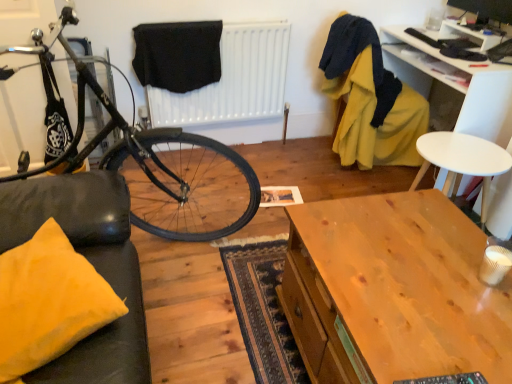
Question: Is yellow fabric pillow at lower left taller than black fabric at center?

Choices:
 (A) yes
 (B) no

Answer: (B)

Question: Is yellow fabric pillow at lower left far from black fabric at center?

Choices:
 (A) yes
 (B) no

Answer: (A)

Question: Is yellow fabric pillow at lower left behind black fabric at center?

Choices:
 (A) no
 (B) yes

Answer: (A)

Question: Does yellow fabric pillow at lower left have a lesser height compared to black fabric at center?

Choices:
 (A) no
 (B) yes

Answer: (B)

Question: Is yellow fabric pillow at lower left next to black fabric at center?

Choices:
 (A) yes
 (B) no

Answer: (B)

Question: Is yellow fabric pillow at lower left located outside black fabric at center?

Choices:
 (A) yes
 (B) no

Answer: (A)

Question: Can you confirm if white plastic chair at upper right, which is the first desk from back to front, is positioned to the left of black fabric at upper center?

Choices:
 (A) no
 (B) yes

Answer: (A)

Question: Does white plastic chair at upper right, which is the 1th desk in top-to-bottom order, have a larger size compared to black fabric at upper center?

Choices:
 (A) yes
 (B) no

Answer: (A)

Question: Does white plastic chair at upper right, placed as the second desk when sorted from left to right, have a lesser width compared to black fabric at upper center?

Choices:
 (A) yes
 (B) no

Answer: (B)

Question: Is the surface of white plastic chair at upper right, positioned as the first desk in right-to-left order, in direct contact with black fabric at upper center?

Choices:
 (A) yes
 (B) no

Answer: (B)

Question: Is white plastic chair at upper right, which is the 1th desk in top-to-bottom order, facing towards black fabric at upper center?

Choices:
 (A) yes
 (B) no

Answer: (A)

Question: Is black fabric at upper center at the back of white plastic chair at upper right, which is the 2th desk from front to back?

Choices:
 (A) yes
 (B) no

Answer: (B)

Question: From a real-world perspective, is yellow fabric armchair at upper right positioned under shiny black bicycle at left based on gravity?

Choices:
 (A) no
 (B) yes

Answer: (B)